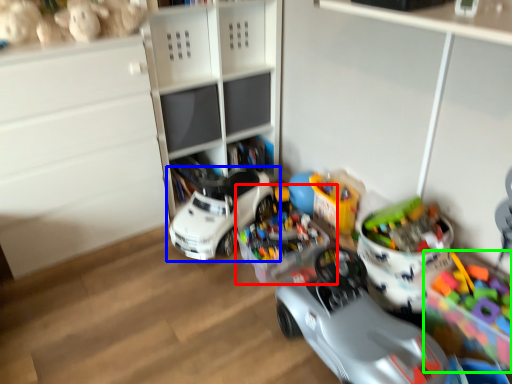
Question: Which object is the farthest from toy (highlighted by a red box)? Choose among these: toy (highlighted by a blue box) or toy (highlighted by a green box).

Choices:
 (A) toy
 (B) toy

Answer: (B)